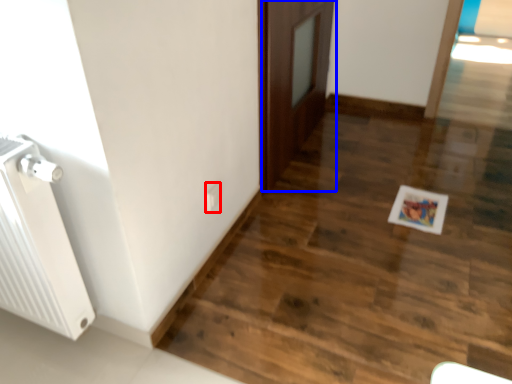
Question: Which object is closer to the camera taking this photo, electric outlet (highlighted by a red box) or door (highlighted by a blue box)?

Choices:
 (A) electric outlet
 (B) door

Answer: (A)